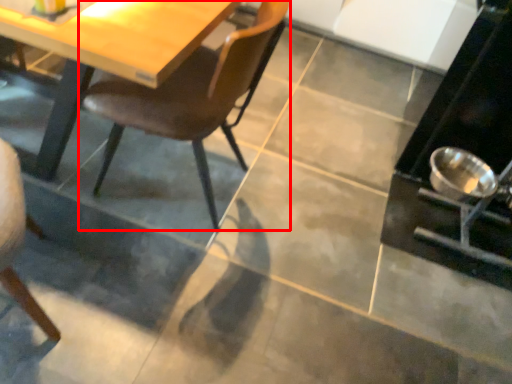
Question: Considering the relative positions of chair (annotated by the red box) and appliance in the image provided, where is chair (annotated by the red box) located with respect to the staircase?

Choices:
 (A) left
 (B) right

Answer: (A)